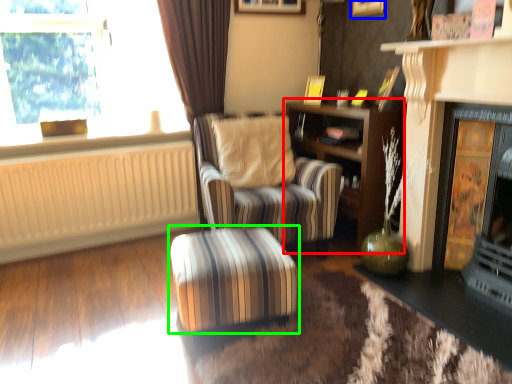
Question: Based on their relative distances, which object is nearer to shelf (highlighted by a red box)? Choose from picture frame (highlighted by a blue box) and table (highlighted by a green box).

Choices:
 (A) picture frame
 (B) table

Answer: (A)